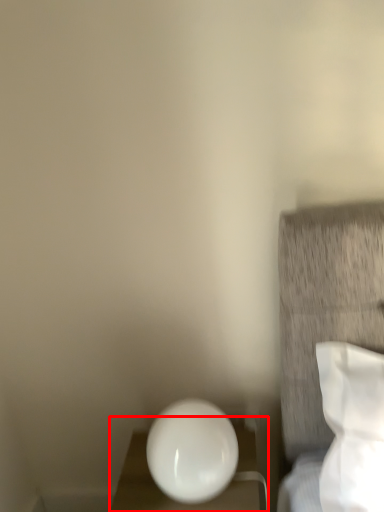
Question: From the image's perspective, what is the correct spatial positioning of furniture (annotated by the red box) in reference to oval?

Choices:
 (A) above
 (B) below

Answer: (B)